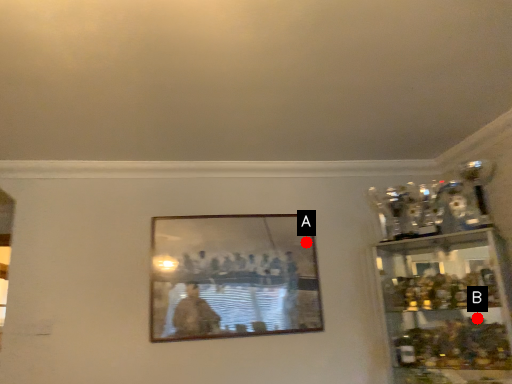
Question: Two points are circled on the image, labeled by A and B beside each circle. Which of the following is the closest to the observer?

Choices:
 (A) A is closer
 (B) B is closer

Answer: (B)